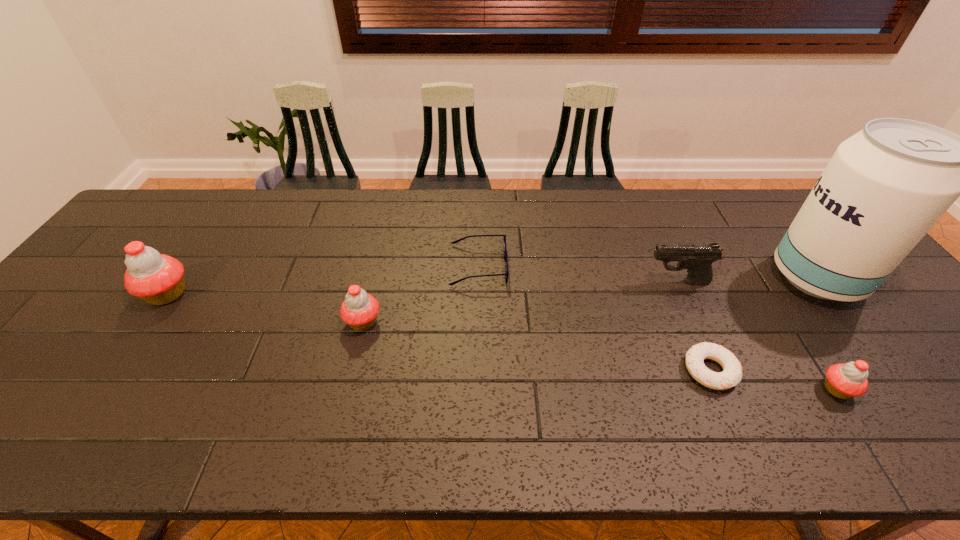
You are a GUI agent. You are given a task and a screenshot of the screen. Output one action in this format:
    pyautogui.click(x=<x>, y=<y>)
    Task: Click on the sixth shortest object
    
    Given the screenshot: What is the action you would take?
    pyautogui.click(x=158, y=279)

Identify the location of the leftmost cupcake. tap(158, 279).

This screenshot has height=540, width=960. Identify the location of the second cupcake from left to right. pos(359,310).

Where is `the sixth object from right to left`? the sixth object from right to left is located at coordinates (359, 310).

This screenshot has width=960, height=540. Find the location of `the third shortest object`. the third shortest object is located at coordinates (844, 381).

The width and height of the screenshot is (960, 540). Find the location of `the nearest cupcake`. the nearest cupcake is located at coordinates (844, 381).

Locate an element on the screen. spectacles is located at coordinates (506, 274).

At what (x,y) coordinates should I click in order to perform the action: click on the sixth tallest object. Please return your answer as a coordinate pair (x, y). The height and width of the screenshot is (540, 960). Looking at the image, I should click on (506, 274).

The width and height of the screenshot is (960, 540). Identify the location of pistol. (697, 258).

Where is `the tallest object`? the tallest object is located at coordinates coord(884,188).